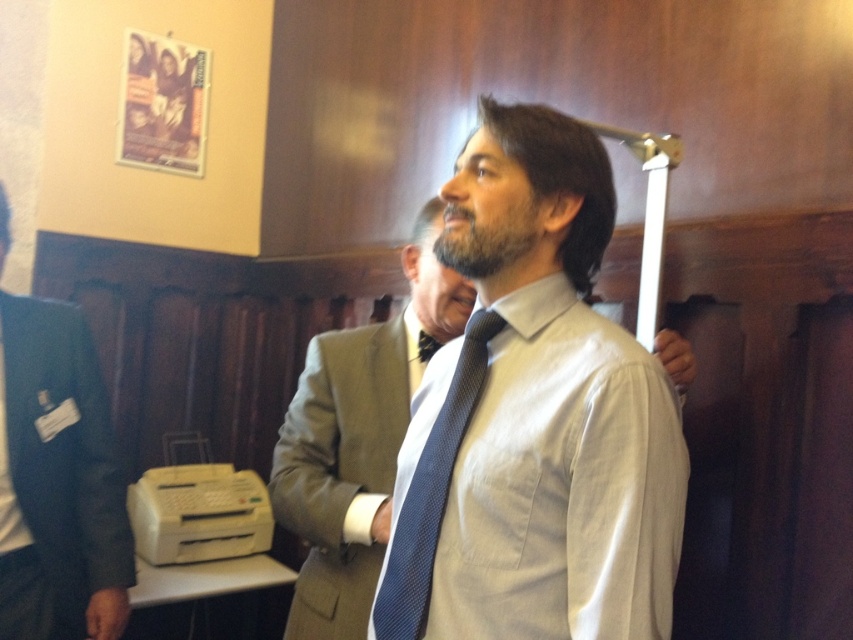
You are organizing a photo shoot and need to ensure that the dark blue suit at left and the blue textured tie at center are positioned correctly according to the scene. Based on the description, which object is located lower in the image?

The dark blue suit at left is located below the blue textured tie at center, so the dark blue suit at left is positioned lower in the image.

You are organizing a charity event and need to arrange the dark blue suit at left and the blue textured tie at center on a display rack. According to the image, which item should be placed to the left of the other?

The dark blue suit at left should be placed to the left of the blue textured tie at center because the dark blue suit at left is positioned on the left side of blue textured tie at center in the image.